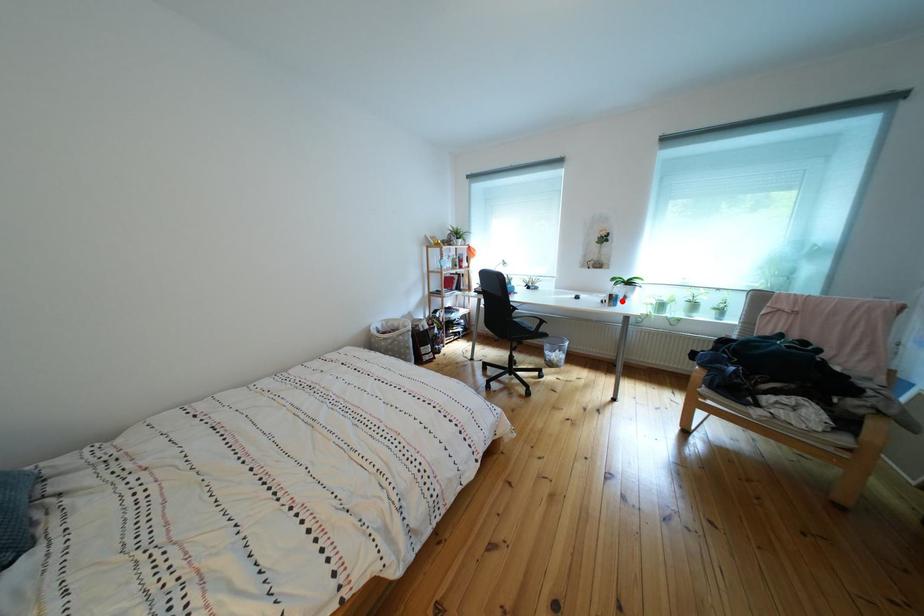
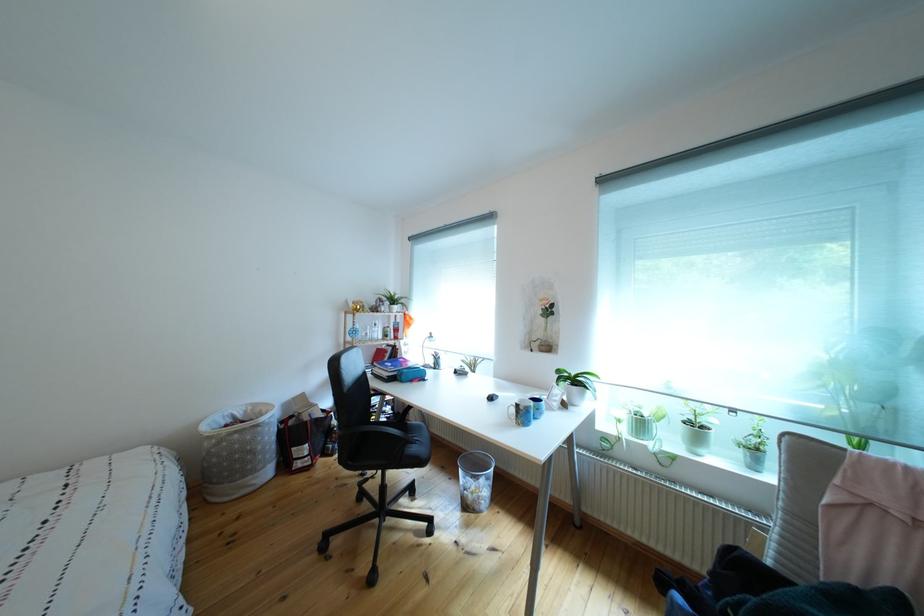
Question: I am providing you with two images of the same scene from different viewpoints. Given a red point in image1, look at the same physical point in image2. Is it:

Choices:
 (A) Closer to the viewpoint
 (B) Farther from the viewpoint

Answer: (B)